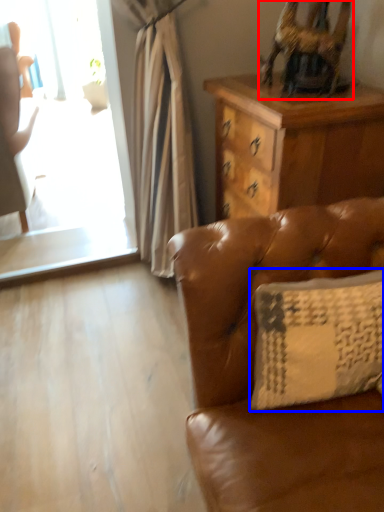
Question: Which point is closer to the camera, swivel chair (highlighted by a red box) or pillow (highlighted by a blue box)?

Choices:
 (A) swivel chair
 (B) pillow

Answer: (B)